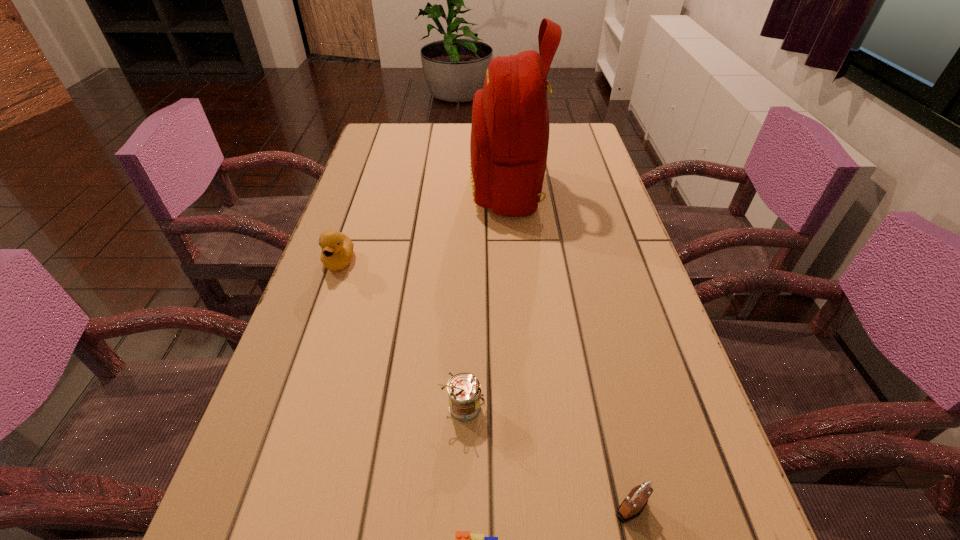
What are the coordinates of `blank region between the third farthest object and the tallest object` in the screenshot? It's located at (485, 299).

You are a GUI agent. You are given a task and a screenshot of the screen. Output one action in this format:
    pyautogui.click(x=<x>, y=<y>)
    Task: Click on the free space that is in between the third nearest object and the second nearest object
    
    Given the screenshot: What is the action you would take?
    pyautogui.click(x=547, y=458)

Where is `unoccupied position between the tallest object and the can`? Image resolution: width=960 pixels, height=540 pixels. unoccupied position between the tallest object and the can is located at coordinates (485, 299).

The width and height of the screenshot is (960, 540). In order to click on vacant area between the backpack and the leftmost object in this screenshot , I will do `click(423, 225)`.

What are the coordinates of `blank region between the farthest object and the duckling` in the screenshot? It's located at (423, 225).

Where is `free area in between the can and the second nearest object`? The height and width of the screenshot is (540, 960). free area in between the can and the second nearest object is located at coordinates (547, 458).

This screenshot has height=540, width=960. Find the location of `free spot between the duckling and the farthest object`. free spot between the duckling and the farthest object is located at coordinates (423, 225).

Select which object appears as the closest to the rightmost object. Please provide its 2D coordinates. Your answer should be formatted as a tuple, i.e. [(x, y)], where the tuple contains the x and y coordinates of a point satisfying the conditions above.

[(463, 539)]

Find the location of a particular element. The width and height of the screenshot is (960, 540). the fourth closest object relative to the padlock is located at coordinates (337, 249).

Locate an element on the screen. Image resolution: width=960 pixels, height=540 pixels. free space that satisfies the following two spatial constraints: 1. facing forward on the can; 2. on the left side of the leftmost object is located at coordinates (289, 409).